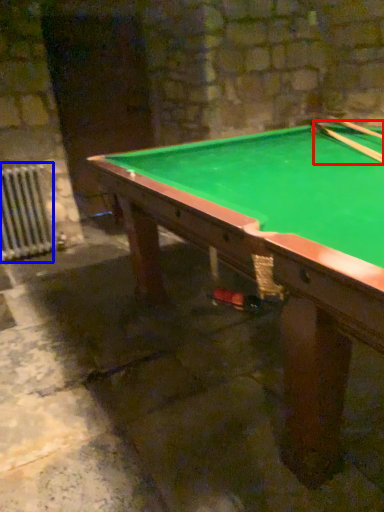
Question: Which object appears closest to the camera in this image, cue (highlighted by a red box) or radiator (highlighted by a blue box)?

Choices:
 (A) cue
 (B) radiator

Answer: (A)